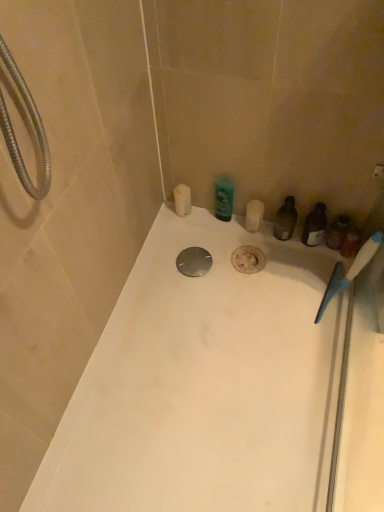
At what (x,y) coordinates should I click in order to perform the action: click on vacant space that's between translucent plastic bottle at right and white matte candle at upper left, the first toiletry from the left. Please return your answer as a coordinate pair (x, y). Image resolution: width=384 pixels, height=512 pixels. Looking at the image, I should click on (227, 228).